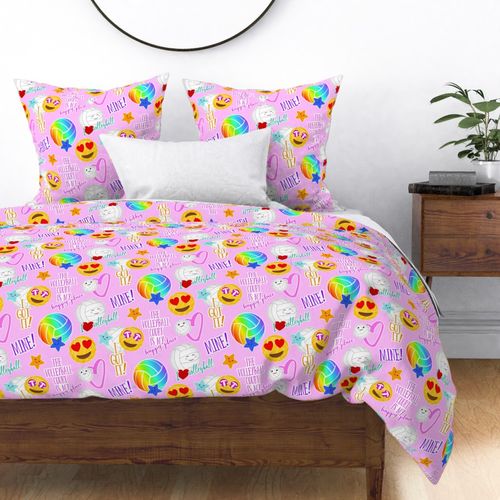
At what (x,y) coordinates should I click in order to perform the action: click on book. Please return your answer as a coordinate pair (x, y). The image size is (500, 500). Looking at the image, I should click on (468, 188), (459, 180).